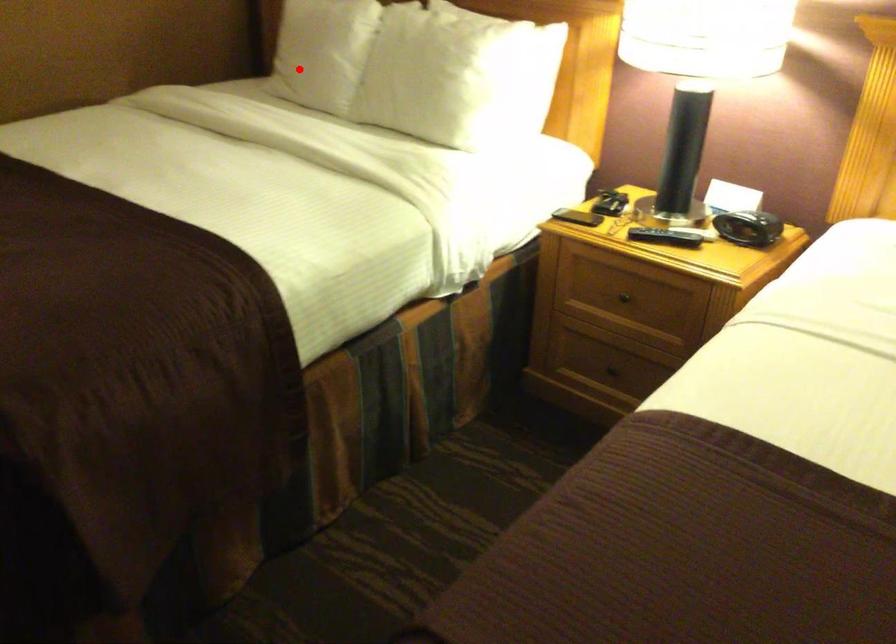
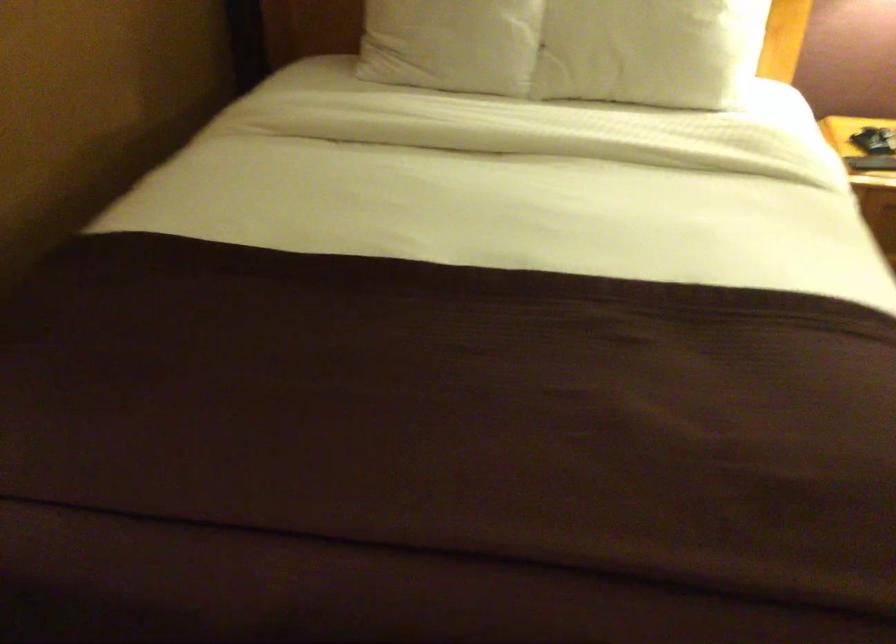
Question: I am providing you with two images of the same scene from different viewpoints. Image1 has a red point marked. In image2, the corresponding 3D location appears at what relative position? Reply with the corresponding letter.

Choices:
 (A) Closer
 (B) Farther

Answer: (A)